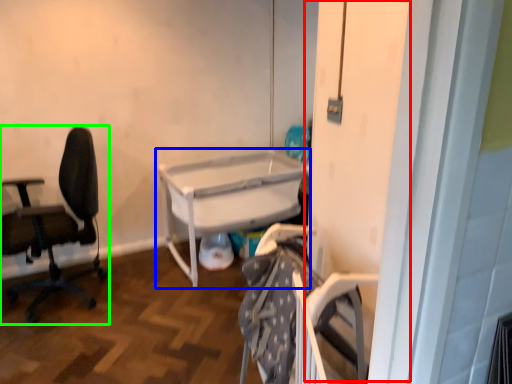
Question: Estimate the real-world distances between objects in this image. Which object is farther from screen door (highlighted by a red box), table (highlighted by a blue box) or chair (highlighted by a green box)?

Choices:
 (A) table
 (B) chair

Answer: (B)